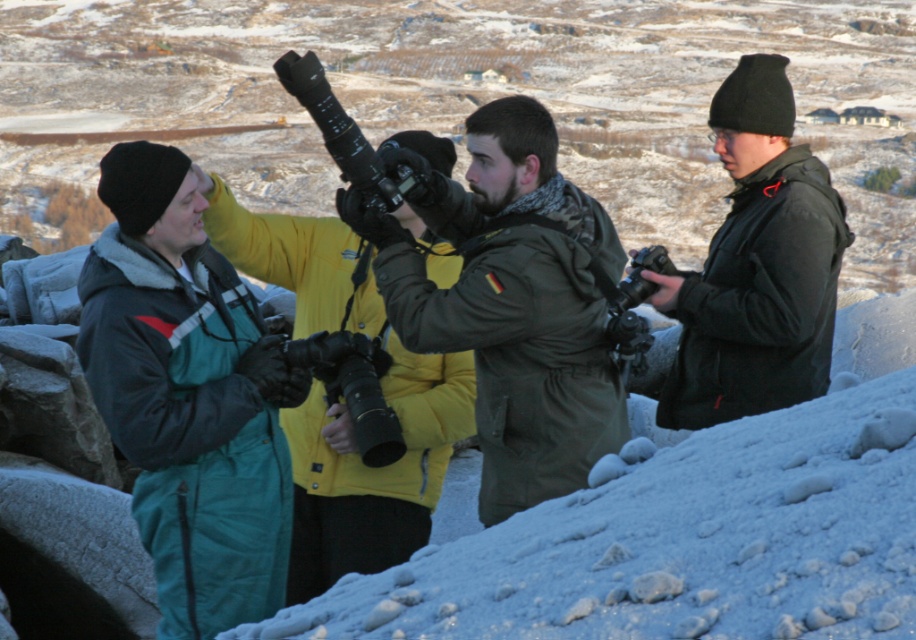
You are standing at the origin point in the image. There is a matte green jacket at center represented by point (513, 301). Which direction should you move to reach the matte green jacket at center?

The point (513, 301) is the location of the matte green jacket at center, so you are already at its position. No movement is needed.

You are a photographer trying to locate the yellow puffy jacket at center in the snowy landscape. Based on the coordinates provided, can you determine its exact position in the image?

The yellow puffy jacket at center is located at coordinates point (x=342, y=404).

You are a photographer trying to take a photo of the matte green jacket at center and the yellow puffy jacket at center. Which jacket will appear closer to the camera in the photo?

The matte green jacket at center will appear closer to the camera in the photo because the yellow puffy jacket at center is behind it.